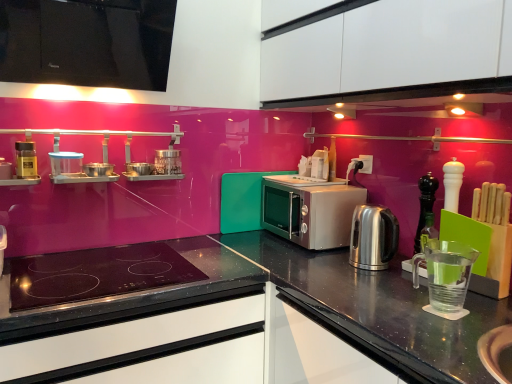
Measure the distance between point [0,175] and camera.

The distance of point [0,175] from camera is 1.55 meters.

Measure the distance between black granite countertop at center and camera.

black granite countertop at center is 87.93 centimeters from camera.

Describe the element at coordinates (388, 48) in the screenshot. I see `white matte cabinet at upper center, the 2th cabinetry in the left-to-right sequence` at that location.

Locate an element on the screen. This screenshot has width=512, height=384. clear plastic container at upper left, acting as the second appliance starting from the top is located at coordinates (66, 163).

This screenshot has width=512, height=384. Describe the element at coordinates (310, 212) in the screenshot. I see `satin silver microwave at center` at that location.

Measure the distance between point (59, 301) and camera.

Point (59, 301) and camera are 1.24 meters apart from each other.

Identify the location of matte black spice container at left, the 1th appliance when ordered from left to right. (5, 169).

Locate an element on the screen. The image size is (512, 384). appliance below the satin silver microwave at center (from the image's perspective) is located at coordinates (445, 276).

From a real-world perspective, does satin silver microwave at center stand above transparent plastic measuring cup at right, positioned as the fourth appliance in left-to-right order?

Yes, from a real-world perspective, satin silver microwave at center is above transparent plastic measuring cup at right, positioned as the fourth appliance in left-to-right order.

Based on the photo, which object is positioned more to the left, satin silver microwave at center or transparent plastic measuring cup at right, which is counted as the 4th appliance, starting from the top?

From the viewer's perspective, satin silver microwave at center appears more on the left side.

Which of these two, satin silver microwave at center or transparent plastic measuring cup at right, which is counted as the 4th appliance, starting from the top, stands shorter?

transparent plastic measuring cup at right, which is counted as the 4th appliance, starting from the top.

What's the angular difference between clear plastic container at upper left, which is counted as the 2th appliance, starting from the right, and black matte drawer at lower left's facing directions?

The angle between the facing direction of clear plastic container at upper left, which is counted as the 2th appliance, starting from the right, and the facing direction of black matte drawer at lower left is 1.62 degrees.

Choose the correct answer: Is clear plastic container at upper left, arranged as the third appliance when ordered from the bottom, inside black matte drawer at lower left or outside it?

clear plastic container at upper left, arranged as the third appliance when ordered from the bottom, is not enclosed by black matte drawer at lower left.

From a real-world perspective, relative to black matte drawer at lower left, is clear plastic container at upper left, which is the third appliance from left to right, vertically above or below?

Clearly, from a real-world perspective, clear plastic container at upper left, which is the third appliance from left to right, is above black matte drawer at lower left.

Between clear plastic container at upper left, arranged as the third appliance when ordered from the bottom, and black matte drawer at lower left, which one has more height?

With more height is black matte drawer at lower left.

Is satin silver microwave at center in front of or behind white matte cabinet at upper center, the first cabinetry from the right, in the image?

satin silver microwave at center is positioned farther from the viewer than white matte cabinet at upper center, the first cabinetry from the right.

From the image's perspective, between satin silver microwave at center and white matte cabinet at upper center, the 2th cabinetry in the left-to-right sequence, which one is located above?

white matte cabinet at upper center, the 2th cabinetry in the left-to-right sequence, appears higher in the image.

Is satin silver microwave at center looking in the opposite direction of white matte cabinet at upper center, the 2th cabinetry in the left-to-right sequence?

satin silver microwave at center is not turned away from white matte cabinet at upper center, the 2th cabinetry in the left-to-right sequence.

Between satin silver microwave at center and white matte cabinet at upper center, the 2th cabinetry in the left-to-right sequence, which one has smaller width?

Thinner between the two is white matte cabinet at upper center, the 2th cabinetry in the left-to-right sequence.

Which of these two, clear plastic container at upper left, which is the third appliance from left to right, or matte black spice container at left, arranged as the fourth appliance when viewed from the right, is thinner?

Thinner between the two is clear plastic container at upper left, which is the third appliance from left to right.

Is clear plastic container at upper left, which is counted as the 2th appliance, starting from the right, bigger or smaller than matte black spice container at left, the 1th appliance when ordered from left to right?

Clearly, clear plastic container at upper left, which is counted as the 2th appliance, starting from the right, is larger in size than matte black spice container at left, the 1th appliance when ordered from left to right.

From their relative heights in the image, would you say clear plastic container at upper left, acting as the second appliance starting from the top, is taller or shorter than matte black spice container at left, the 1th appliance when ordered from left to right?

Considering their sizes, clear plastic container at upper left, acting as the second appliance starting from the top, has more height than matte black spice container at left, the 1th appliance when ordered from left to right.

Does clear plastic container at upper left, which is the third appliance from left to right, lie behind matte black spice container at left, arranged as the fourth appliance when viewed from the right?

Yes, it is behind matte black spice container at left, arranged as the fourth appliance when viewed from the right.

Considering the relative sizes of white matte cabinet at upper center, the 2th cabinetry in the left-to-right sequence, and matte black spice container at left, which appears as the third appliance when viewed from the top, in the image provided, is white matte cabinet at upper center, the 2th cabinetry in the left-to-right sequence, thinner than matte black spice container at left, which appears as the third appliance when viewed from the top,?

Incorrect, the width of white matte cabinet at upper center, the 2th cabinetry in the left-to-right sequence, is not less than that of matte black spice container at left, which appears as the third appliance when viewed from the top.

Starting from the white matte cabinet at upper center, the 2th cabinetry in the left-to-right sequence, which appliance is the 2nd one behind? Please provide its 2D coordinates.

[(5, 169)]

Is white matte cabinet at upper center, the first cabinetry from the right, in contact with matte black spice container at left, arranged as the fourth appliance when viewed from the right?

They are not placed beside each other.

Can you confirm if white matte cabinet at upper center, the 2th cabinetry in the left-to-right sequence, is taller than matte black spice container at left, the 1th appliance when ordered from left to right?

Indeed, white matte cabinet at upper center, the 2th cabinetry in the left-to-right sequence, has a greater height compared to matte black spice container at left, the 1th appliance when ordered from left to right.

From the image's perspective, is transparent plastic measuring cup at right, the first appliance from the right, positioned above or below satin metallic kettle at right?

transparent plastic measuring cup at right, the first appliance from the right, is situated lower than satin metallic kettle at right in the image.

Is transparent plastic measuring cup at right, the first appliance from the right, positioned with its back to satin metallic kettle at right?

No, transparent plastic measuring cup at right, the first appliance from the right, is not facing the opposite direction of satin metallic kettle at right.

At what (x,y) coordinates should I click in order to perform the action: click on the 3rd appliance in front when counting from the satin metallic kettle at right. Please return your answer as a coordinate pair (x, y). Looking at the image, I should click on pos(445,276).

Is black matte drawer at lower left located outside satin silver microwave at center?

black matte drawer at lower left lies outside satin silver microwave at center's area.

Considering the relative sizes of black matte drawer at lower left and satin silver microwave at center in the image provided, is black matte drawer at lower left wider than satin silver microwave at center?

Correct, the width of black matte drawer at lower left exceeds that of satin silver microwave at center.

Consider the image. Considering the positions of objects black matte drawer at lower left and satin silver microwave at center in the image provided, who is more to the right, black matte drawer at lower left or satin silver microwave at center?

satin silver microwave at center.

Is black matte drawer at lower left next to satin silver microwave at center and touching it?

No.

Locate an element on the screen. the 4th appliance in front of the satin silver microwave at center, starting your count from the anchor is located at coordinates (445, 276).

From the image's perspective, starting from the black matte drawer at lower left, which appliance is the 3rd one above? Please provide its 2D coordinates.

[(66, 163)]

From the image, which object appears to be farther from black granite countertop at center, black matte drawer at lower left or satin silver microwave at center?

Based on the image, satin silver microwave at center appears to be further to black granite countertop at center.

Based on the photo, from the image, which object appears to be nearer to black glossy cabinet at upper left, positioned as the 1th cabinetry in left-to-right order, matte black spice container at left, which appears as the third appliance when viewed from the top, or satin silver microwave at center?

Based on the image, matte black spice container at left, which appears as the third appliance when viewed from the top, appears to be nearer to black glossy cabinet at upper left, positioned as the 1th cabinetry in left-to-right order.

Estimate the real-world distances between objects in this image. Which object is closer to matte black spice container at left, which appears as the 2th appliance when ordered from the bottom, black glossy cabinet at upper left, placed as the second cabinetry when sorted from right to left, or satin silver microwave at center?

black glossy cabinet at upper left, placed as the second cabinetry when sorted from right to left, is closer to matte black spice container at left, which appears as the 2th appliance when ordered from the bottom.

Considering their positions, is satin silver microwave at center positioned further to black granite countertop at center than transparent plastic measuring cup at right, which is the first appliance from bottom to top?

→ Among the two, satin silver microwave at center is located further to black granite countertop at center.

From the image, which object appears to be nearer to satin silver microwave at center, black glass cooktop at center or white matte cabinet at upper center, the 2th cabinetry in the left-to-right sequence?

Among the two, white matte cabinet at upper center, the 2th cabinetry in the left-to-right sequence, is located nearer to satin silver microwave at center.

Looking at the image, which one is located further to black granite countertop at center, white matte cabinet at upper center, the first cabinetry from the right, or transparent plastic measuring cup at right, the first appliance from the right?

Among the two, white matte cabinet at upper center, the first cabinetry from the right, is located further to black granite countertop at center.

Considering their positions, is matte black spice container at left, which appears as the third appliance when viewed from the top, positioned closer to satin silver microwave at center than matte black spice jar at left, which is the fourth appliance in bottom-to-top order?

matte black spice jar at left, which is the fourth appliance in bottom-to-top order, is positioned closer to the anchor satin silver microwave at center.

Estimate the real-world distances between objects in this image. Which object is closer to satin silver microwave at center, matte black spice container at left, which appears as the 2th appliance when ordered from the bottom, or black granite countertop at center?

black granite countertop at center lies closer to satin silver microwave at center than the other object.

You are a GUI agent. You are given a task and a screenshot of the screen. Output one action in this format:
    pyautogui.click(x=<x>, y=<y>)
    Task: Click on the cabinetry located between clear plastic container at upper left, which is counted as the 2th appliance, starting from the right, and satin metallic kettle at right in the left-right direction
    
    Given the screenshot: What is the action you would take?
    pyautogui.click(x=87, y=42)

The height and width of the screenshot is (384, 512). I want to click on gas stove between matte black spice jar at left, the 1th appliance viewed from the top, and satin metallic kettle at right, in the horizontal direction, so click(x=96, y=274).

Where is `countertop situated between matte black spice jar at left, which is the fourth appliance in bottom-to-top order, and white matte cabinet at upper center, the 2th cabinetry in the left-to-right sequence, from left to right`? countertop situated between matte black spice jar at left, which is the fourth appliance in bottom-to-top order, and white matte cabinet at upper center, the 2th cabinetry in the left-to-right sequence, from left to right is located at coordinates (317, 302).

The image size is (512, 384). What are the coordinates of `kitchen appliance between clear plastic container at upper left, acting as the second appliance starting from the top, and white matte cabinet at upper center, the first cabinetry from the right` in the screenshot? It's located at (310, 212).